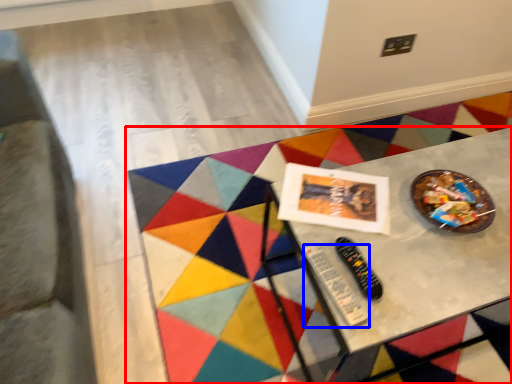
Question: Which object is further to the camera taking this photo, table (highlighted by a red box) or control (highlighted by a blue box)?

Choices:
 (A) table
 (B) control

Answer: (A)